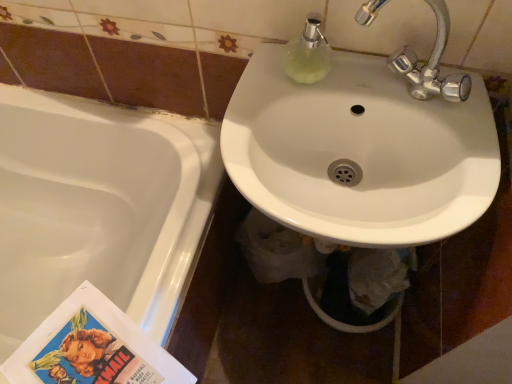
You are a GUI agent. You are given a task and a screenshot of the screen. Output one action in this format:
    pyautogui.click(x=<x>, y=<y>)
    Task: Click on the free space above white glossy sink at center (from a real-world perspective)
    This screenshot has height=384, width=512.
    Given the screenshot: What is the action you would take?
    pyautogui.click(x=386, y=99)